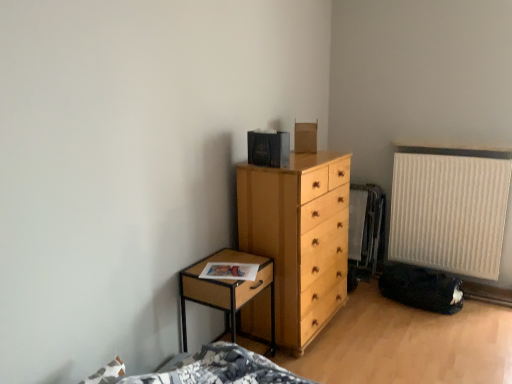
Question: Is woodennightstand at left located within light wood chest of drawers at center?

Choices:
 (A) yes
 (B) no

Answer: (B)

Question: Does light wood chest of drawers at center come in front of woodennightstand at left?

Choices:
 (A) yes
 (B) no

Answer: (B)

Question: Considering the relative sizes of light wood chest of drawers at center and woodennightstand at left in the image provided, is light wood chest of drawers at center thinner than woodennightstand at left?

Choices:
 (A) no
 (B) yes

Answer: (A)

Question: Is light wood chest of drawers at center aimed at woodennightstand at left?

Choices:
 (A) yes
 (B) no

Answer: (B)

Question: Is light wood chest of drawers at center behind woodennightstand at left?

Choices:
 (A) yes
 (B) no

Answer: (A)

Question: Can you confirm if light wood chest of drawers at center is wider than woodennightstand at left?

Choices:
 (A) no
 (B) yes

Answer: (B)

Question: Considering the relative positions of woodennightstand at left and light wood chest of drawers at center in the image provided, is woodennightstand at left to the left of light wood chest of drawers at center from the viewer's perspective?

Choices:
 (A) yes
 (B) no

Answer: (A)

Question: Would you say woodennightstand at left contains light wood chest of drawers at center?

Choices:
 (A) yes
 (B) no

Answer: (B)

Question: Considering the relative sizes of woodennightstand at left and light wood chest of drawers at center in the image provided, is woodennightstand at left bigger than light wood chest of drawers at center?

Choices:
 (A) no
 (B) yes

Answer: (A)

Question: Is woodennightstand at left positioned behind light wood chest of drawers at center?

Choices:
 (A) no
 (B) yes

Answer: (A)

Question: From the image's perspective, would you say woodennightstand at left is shown under light wood chest of drawers at center?

Choices:
 (A) yes
 (B) no

Answer: (A)

Question: Can you confirm if woodennightstand at left is positioned to the right of light wood chest of drawers at center?

Choices:
 (A) no
 (B) yes

Answer: (A)

Question: Does light wood chest of drawers at center have a larger size compared to beige ribbed radiator at right?

Choices:
 (A) yes
 (B) no

Answer: (A)